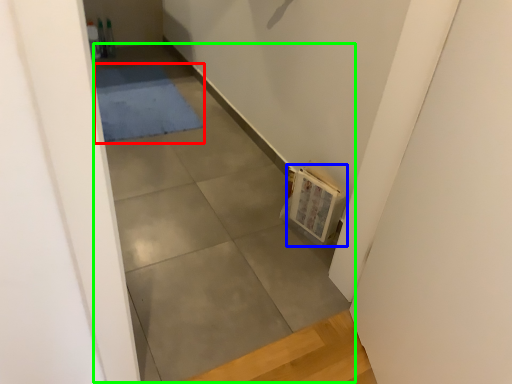
Question: Which object is positioned farthest from mat (highlighted by a red box)? Select from book (highlighted by a blue box) and concrete (highlighted by a green box).

Choices:
 (A) book
 (B) concrete

Answer: (A)